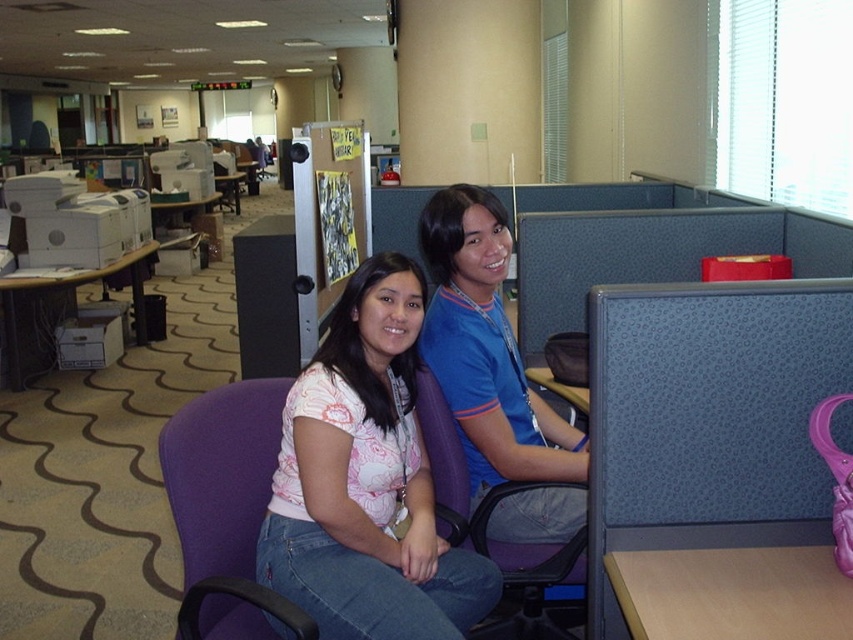
Describe the element at coordinates (225, 508) in the screenshot. The image size is (853, 640). I see `purple fabric swivel chair at lower left` at that location.

The height and width of the screenshot is (640, 853). What do you see at coordinates (225, 508) in the screenshot?
I see `purple fabric swivel chair at lower left` at bounding box center [225, 508].

At what (x,y) coordinates should I click in order to perform the action: click on purple fabric swivel chair at lower left. Please return your answer as a coordinate pair (x, y). This screenshot has width=853, height=640. Looking at the image, I should click on (225, 508).

Can you confirm if matte blue shirt at center is bigger than white plastic printer at left?

Incorrect, matte blue shirt at center is not larger than white plastic printer at left.

Between matte blue shirt at center and white plastic printer at left, which one has less height?

matte blue shirt at center

Is point (503, 429) more distant than point (80, 273)?

No, (503, 429) is closer to viewer.

Identify the location of matte blue shirt at center. The width and height of the screenshot is (853, 640). (486, 349).

Can you confirm if pink printed blouse at center is positioned to the right of purple fabric swivel chair at lower left?

Correct, you'll find pink printed blouse at center to the right of purple fabric swivel chair at lower left.

Is pink printed blouse at center positioned before purple fabric swivel chair at lower left?

No, it is behind purple fabric swivel chair at lower left.

Is point (390, 276) positioned after point (277, 408)?

No.

This screenshot has width=853, height=640. What are the coordinates of `pink printed blouse at center` in the screenshot? It's located at (366, 481).